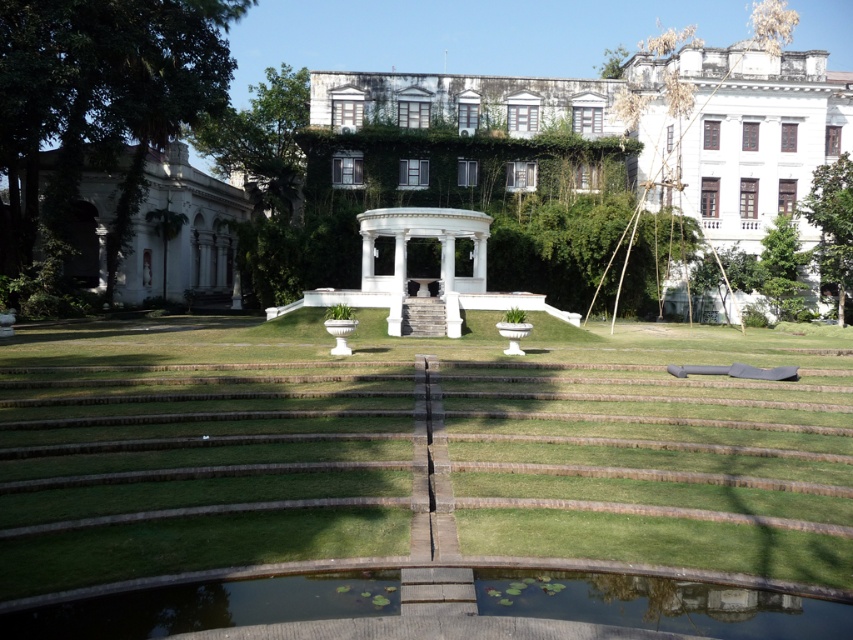
You are standing in the garden and want to walk towards the white marble gazebo at center. Which direction should you move relative to the green grass at center?

To reach the white marble gazebo at center, you should move away from the green grass at center since the gazebo is farther away from the viewer compared to the grass.

You are planning to host a small gathering in this garden and need to set up a table. You have a table that is the same size as the green smooth water at lower center. Will this table fit in the area where the white marble mansion at left is located?

The green smooth water at lower center has a smaller size compared to the white marble mansion at left. Since the table is the same size as the water, it would fit in the area of the mansion because the mansion is larger.

You are standing at the top of the garden steps and want to walk towards the green grass at center. Which direction should you go relative to the white marble gazebo at center?

The green grass at center is located below the white marble gazebo at center, so you should walk downward towards the green grass at center relative to the white marble gazebo at center.